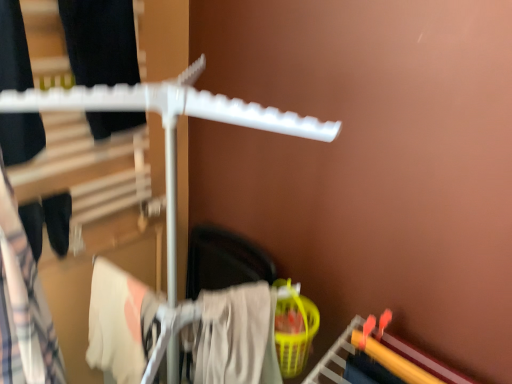
Question: Should I look upward or downward to see matte black pants at left, which ranks as the first clothing in left-to-right order?

Choices:
 (A) down
 (B) up

Answer: (A)

Question: Considering the relative positions of white cotton towel at lower left, arranged as the second clothing when viewed from the left, and matte black pants at left, arranged as the 3th clothing when viewed from the right, in the image provided, is white cotton towel at lower left, arranged as the second clothing when viewed from the left, in front of matte black pants at left, arranged as the 3th clothing when viewed from the right,?

Choices:
 (A) no
 (B) yes

Answer: (A)

Question: Could matte black pants at left, arranged as the 3th clothing when viewed from the right, be considered to be inside white cotton towel at lower left, arranged as the second clothing when viewed from the left?

Choices:
 (A) yes
 (B) no

Answer: (B)

Question: Is white cotton towel at lower left, which appears as the 2th clothing when viewed from the right, oriented away from matte black pants at left, arranged as the 3th clothing when viewed from the right?

Choices:
 (A) yes
 (B) no

Answer: (B)

Question: Would you say white cotton towel at lower left, arranged as the second clothing when viewed from the left, is outside matte black pants at left, which ranks as the first clothing in left-to-right order?

Choices:
 (A) yes
 (B) no

Answer: (A)

Question: From a real-world perspective, is white cotton towel at lower left, which appears as the 2th clothing when viewed from the right, located higher than matte black pants at left, which ranks as the first clothing in left-to-right order?

Choices:
 (A) no
 (B) yes

Answer: (A)

Question: From the image's perspective, is white cotton towel at lower left, arranged as the second clothing when viewed from the left, on top of matte black pants at left, arranged as the 3th clothing when viewed from the right?

Choices:
 (A) no
 (B) yes

Answer: (A)

Question: Is the depth of white cotton towel at lower left, arranged as the second clothing when viewed from the left, greater than that of beige cotton towel at lower center, the 1th clothing viewed from the right?

Choices:
 (A) yes
 (B) no

Answer: (A)

Question: Is white cotton towel at lower left, arranged as the second clothing when viewed from the left, thinner than beige cotton towel at lower center, the 1th clothing viewed from the right?

Choices:
 (A) no
 (B) yes

Answer: (A)

Question: Is white cotton towel at lower left, which appears as the 2th clothing when viewed from the right, surrounding beige cotton towel at lower center, placed as the third clothing when sorted from left to right?

Choices:
 (A) no
 (B) yes

Answer: (A)

Question: Is white cotton towel at lower left, arranged as the second clothing when viewed from the left, looking in the opposite direction of beige cotton towel at lower center, the 1th clothing viewed from the right?

Choices:
 (A) no
 (B) yes

Answer: (A)

Question: Are white cotton towel at lower left, which appears as the 2th clothing when viewed from the right, and beige cotton towel at lower center, the 1th clothing viewed from the right, located far from each other?

Choices:
 (A) yes
 (B) no

Answer: (B)

Question: Considering the relative positions of white cotton towel at lower left, which appears as the 2th clothing when viewed from the right, and beige cotton towel at lower center, placed as the third clothing when sorted from left to right, in the image provided, is white cotton towel at lower left, which appears as the 2th clothing when viewed from the right, to the left of beige cotton towel at lower center, placed as the third clothing when sorted from left to right, from the viewer's perspective?

Choices:
 (A) no
 (B) yes

Answer: (B)

Question: Considering the relative sizes of matte black pants at left, which ranks as the first clothing in left-to-right order, and beige cotton towel at lower center, placed as the third clothing when sorted from left to right, in the image provided, is matte black pants at left, which ranks as the first clothing in left-to-right order, shorter than beige cotton towel at lower center, placed as the third clothing when sorted from left to right,?

Choices:
 (A) no
 (B) yes

Answer: (A)